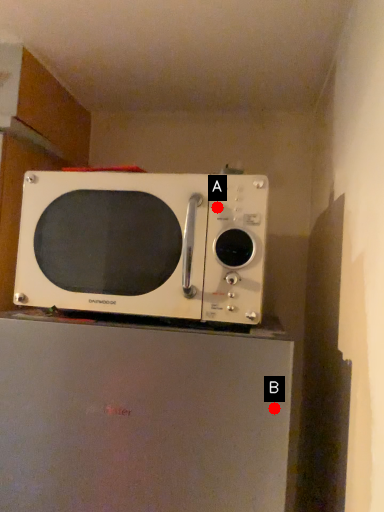
Question: Two points are circled on the image, labeled by A and B beside each circle. Among these points, which one is nearest to the camera?

Choices:
 (A) A is closer
 (B) B is closer

Answer: (B)